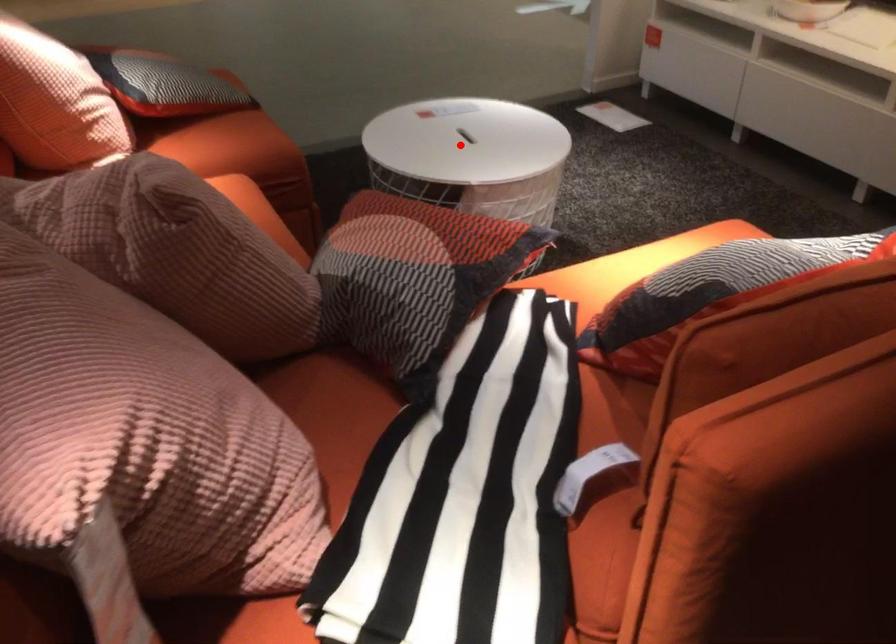
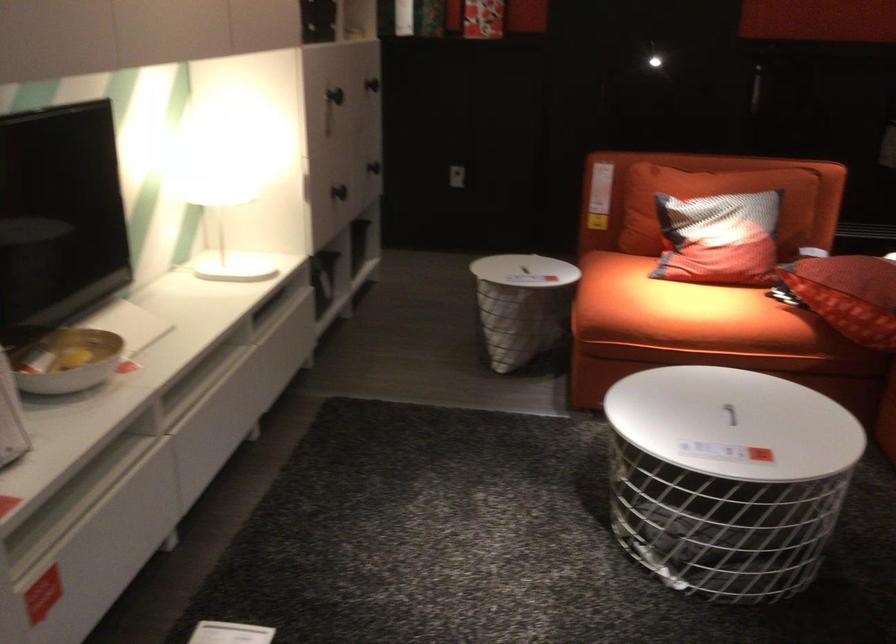
In the second image, find the point that corresponds to the highlighted location in the first image.

(729, 413)